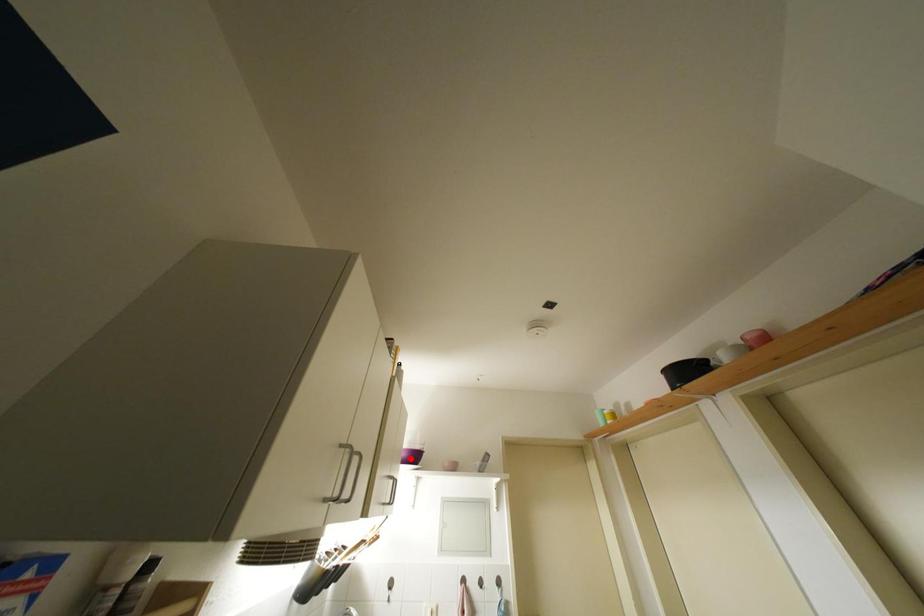
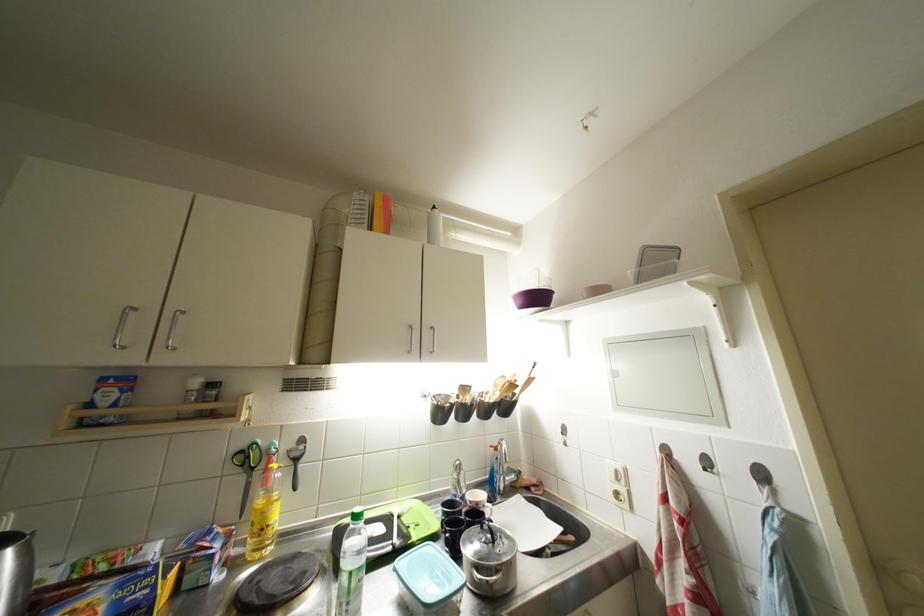
Locate, in the second image, the point that corresponds to the highlighted location in the first image.

(527, 306)